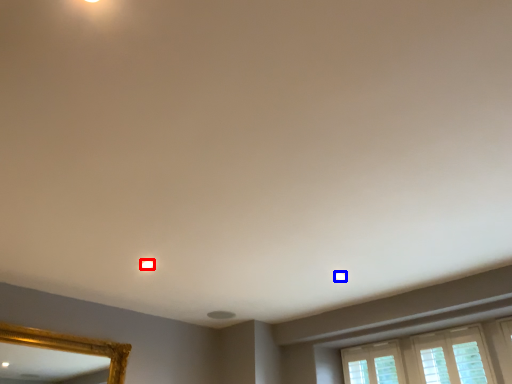
Question: Among these objects, which one is nearest to the camera, lighting (highlighted by a red box) or light (highlighted by a blue box)?

Choices:
 (A) lighting
 (B) light

Answer: (A)